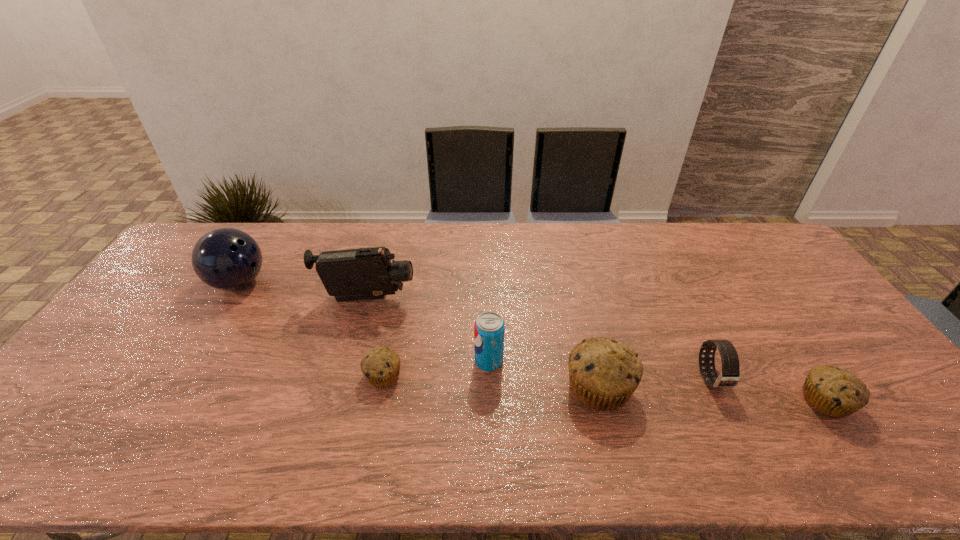
Find the location of a particular element. The height and width of the screenshot is (540, 960). the shortest muffin is located at coordinates (381, 366).

This screenshot has height=540, width=960. Find the location of `the leftmost muffin`. the leftmost muffin is located at coordinates (381, 366).

You are a GUI agent. You are given a task and a screenshot of the screen. Output one action in this format:
    pyautogui.click(x=<x>, y=<y>)
    Task: Click on the third object from right to left
    The width and height of the screenshot is (960, 540).
    Given the screenshot: What is the action you would take?
    pyautogui.click(x=603, y=373)

Locate an element on the screen. The height and width of the screenshot is (540, 960). the second muffin from right to left is located at coordinates tap(603, 373).

Locate an element on the screen. The width and height of the screenshot is (960, 540). the second shortest muffin is located at coordinates (835, 392).

Identify the location of the sixth tallest object. pyautogui.click(x=835, y=392).

Image resolution: width=960 pixels, height=540 pixels. Identify the location of bowling ball. (226, 258).

At what (x,y) coordinates should I click in order to perform the action: click on the fourth object from left to right. Please return your answer as a coordinate pair (x, y). Looking at the image, I should click on (489, 328).

Where is `camcorder`? The image size is (960, 540). camcorder is located at coordinates tap(366, 273).

This screenshot has height=540, width=960. I want to click on watch, so click(729, 377).